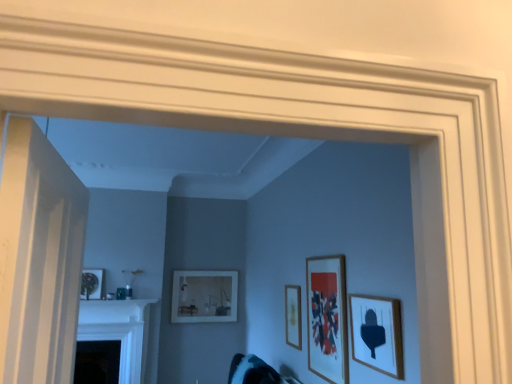
You are a GUI agent. You are given a task and a screenshot of the screen. Output one action in this format:
    pyautogui.click(x=<x>, y=<y>)
    Task: Click on the white wooden door at left
    The width and height of the screenshot is (512, 384).
    Given the screenshot: What is the action you would take?
    39,258

What is the approximate width of white wooden door at left?

The width of white wooden door at left is 19.13 centimeters.

How much space does matte white picture frame at center, which ranks as the 1th picture frame in back-to-front order, occupy vertically?

It is 28.64 inches.

Measure the distance between point (288, 289) and camera.

They are 12.94 feet apart.

Where is `wooden picture frame at right, which is the 4th picture frame from back to front`? wooden picture frame at right, which is the 4th picture frame from back to front is located at coordinates (377, 333).

What do you see at coordinates (119, 331) in the screenshot?
I see `black glossy fireplace at lower left` at bounding box center [119, 331].

Where is `white wooden door at left`? The image size is (512, 384). white wooden door at left is located at coordinates (39, 258).

Considering the positions of objects wooden picture frame at center, the 2th picture frame when ordered from back to front, and wooden picture frame at right, which is the 4th picture frame from back to front, in the image provided, who is more to the left, wooden picture frame at center, the 2th picture frame when ordered from back to front, or wooden picture frame at right, which is the 4th picture frame from back to front,?

wooden picture frame at center, the 2th picture frame when ordered from back to front.

From a real-world perspective, is wooden picture frame at center, the 2th picture frame when ordered from back to front, over wooden picture frame at right, acting as the fourth picture frame starting from the left?

No.

Image resolution: width=512 pixels, height=384 pixels. In order to click on the 2nd picture frame positioned below the wooden picture frame at right, acting as the fourth picture frame starting from the left (from the image's perspective) in this screenshot , I will do `click(293, 316)`.

Based on the photo, who is shorter, matte white picture frame at center, the fourth picture frame when ordered from right to left, or black glossy fireplace at lower left?

matte white picture frame at center, the fourth picture frame when ordered from right to left, is shorter.

From the image's perspective, who appears lower, matte white picture frame at center, the fourth picture frame when ordered from front to back, or black glossy fireplace at lower left?

From the image's view, black glossy fireplace at lower left is below.

Is matte white picture frame at center, which is the first picture frame from left to right, situated inside black glossy fireplace at lower left or outside?

matte white picture frame at center, which is the first picture frame from left to right, is located beyond the bounds of black glossy fireplace at lower left.

Does matte white picture frame at center, which ranks as the 1th picture frame in back-to-front order, appear on the left side of black glossy fireplace at lower left?

No, matte white picture frame at center, which ranks as the 1th picture frame in back-to-front order, is not to the left of black glossy fireplace at lower left.

Is the position of matte wooden picture frame at center, the 2th picture frame positioned from the right, less distant than that of white wooden door at left?

That is False.

How distant is matte wooden picture frame at center, the 2th picture frame positioned from the right, from white wooden door at left?

A distance of 6.35 feet exists between matte wooden picture frame at center, the 2th picture frame positioned from the right, and white wooden door at left.

Can you confirm if matte wooden picture frame at center, which appears as the second picture frame when viewed from the front, is wider than white wooden door at left?

No, matte wooden picture frame at center, which appears as the second picture frame when viewed from the front, is not wider than white wooden door at left.

Could you tell me if teal fabric swivel chair at lower center is turned towards matte white picture frame at center, which is the first picture frame from left to right?

No, teal fabric swivel chair at lower center is not facing towards matte white picture frame at center, which is the first picture frame from left to right.

In order to click on swivel chair lying in front of the matte white picture frame at center, which is the first picture frame from left to right in this screenshot , I will do `click(255, 372)`.

Would you consider teal fabric swivel chair at lower center to be distant from matte white picture frame at center, which ranks as the 1th picture frame in back-to-front order?

teal fabric swivel chair at lower center is positioned a significant distance from matte white picture frame at center, which ranks as the 1th picture frame in back-to-front order.

Is teal fabric swivel chair at lower center spatially inside matte white picture frame at center, which is the first picture frame from left to right, or outside of it?

teal fabric swivel chair at lower center is spatially situated outside matte white picture frame at center, which is the first picture frame from left to right.

In the scene shown: What's the angular difference between wooden picture frame at right, acting as the fourth picture frame starting from the left, and teal fabric swivel chair at lower center's facing directions?

wooden picture frame at right, acting as the fourth picture frame starting from the left, and teal fabric swivel chair at lower center are facing 2.17 degrees away from each other.

Can you see wooden picture frame at right, which ranks as the 1th picture frame in right-to-left order, touching teal fabric swivel chair at lower center?

No, wooden picture frame at right, which ranks as the 1th picture frame in right-to-left order, is not with teal fabric swivel chair at lower center.

From the image's perspective, relative to teal fabric swivel chair at lower center, is wooden picture frame at right, which ranks as the 1th picture frame in right-to-left order, above or below?

wooden picture frame at right, which ranks as the 1th picture frame in right-to-left order, is situated higher than teal fabric swivel chair at lower center in the image.

From a real-world perspective, is wooden picture frame at right, the 1th picture frame when ordered from front to back, beneath teal fabric swivel chair at lower center?

No.

Considering the relative sizes of white wooden door at left and teal fabric swivel chair at lower center in the image provided, is white wooden door at left taller than teal fabric swivel chair at lower center?

Indeed, white wooden door at left has a greater height compared to teal fabric swivel chair at lower center.

Measure the distance from white wooden door at left to teal fabric swivel chair at lower center.

white wooden door at left is 8.55 feet away from teal fabric swivel chair at lower center.

Considering the sizes of objects white wooden door at left and teal fabric swivel chair at lower center in the image provided, who is wider, white wooden door at left or teal fabric swivel chair at lower center?

With larger width is teal fabric swivel chair at lower center.

Considering the positions of points (9, 205) and (273, 380), is point (9, 205) closer to camera compared to point (273, 380)?

Yes, point (9, 205) is in front of point (273, 380).

Considering the sizes of wooden picture frame at right, which is the 4th picture frame from back to front, and black glossy fireplace at lower left in the image, is wooden picture frame at right, which is the 4th picture frame from back to front, taller or shorter than black glossy fireplace at lower left?

wooden picture frame at right, which is the 4th picture frame from back to front, is shorter than black glossy fireplace at lower left.

Is wooden picture frame at right, the 1th picture frame when ordered from front to back, thinner than black glossy fireplace at lower left?

Yes, wooden picture frame at right, the 1th picture frame when ordered from front to back, is thinner than black glossy fireplace at lower left.

Identify the location of fireplace that is on the left side of wooden picture frame at right, acting as the fourth picture frame starting from the left. (119, 331).

Considering the points (395, 345) and (82, 310), which point is behind, point (395, 345) or point (82, 310)?

Positioned behind is point (82, 310).

At what (x,y) coordinates should I click in order to perform the action: click on the 2nd picture frame to the left when counting from the wooden picture frame at right, acting as the fourth picture frame starting from the left. Please return your answer as a coordinate pair (x, y). The height and width of the screenshot is (384, 512). Looking at the image, I should click on (293, 316).

Identify the location of fireplace that appears in front of the matte white picture frame at center, the fourth picture frame when ordered from front to back. (119, 331).

Considering their positions, is white wooden door at left positioned closer to matte white picture frame at center, which is the first picture frame from left to right, than wooden picture frame at right, the 1th picture frame when ordered from front to back?

wooden picture frame at right, the 1th picture frame when ordered from front to back, is positioned closer to the anchor matte white picture frame at center, which is the first picture frame from left to right.

Based on the photo, based on their spatial positions, is wooden picture frame at center, the 2th picture frame when ordered from back to front, or black glossy fireplace at lower left further from matte wooden picture frame at center, the third picture frame from the left?

black glossy fireplace at lower left lies further to matte wooden picture frame at center, the third picture frame from the left, than the other object.

Estimate the real-world distances between objects in this image. Which object is further from matte white picture frame at center, which is the first picture frame from left to right, white wooden door at left or teal fabric swivel chair at lower center?

Based on the image, white wooden door at left appears to be further to matte white picture frame at center, which is the first picture frame from left to right.

Which object lies nearer to the anchor point wooden picture frame at right, which is the 4th picture frame from back to front, matte wooden picture frame at center, the third picture frame from the left, or matte white picture frame at center, which ranks as the 1th picture frame in back-to-front order?

The object closer to wooden picture frame at right, which is the 4th picture frame from back to front, is matte wooden picture frame at center, the third picture frame from the left.

Looking at the image, which one is located further to matte white picture frame at center, the fourth picture frame when ordered from right to left, black glossy fireplace at lower left or white wooden door at left?

Based on the image, white wooden door at left appears to be further to matte white picture frame at center, the fourth picture frame when ordered from right to left.

Estimate the real-world distances between objects in this image. Which object is closer to wooden picture frame at center, the 2th picture frame when ordered from back to front, matte white picture frame at center, which is the first picture frame from left to right, or black glossy fireplace at lower left?

Based on the image, matte white picture frame at center, which is the first picture frame from left to right, appears to be nearer to wooden picture frame at center, the 2th picture frame when ordered from back to front.

Which object lies nearer to the anchor point black glossy fireplace at lower left, wooden picture frame at right, acting as the fourth picture frame starting from the left, or matte wooden picture frame at center, the third picture frame from the left?

matte wooden picture frame at center, the third picture frame from the left.

Which object lies nearer to the anchor point matte white picture frame at center, which is the first picture frame from left to right, teal fabric swivel chair at lower center or matte wooden picture frame at center, which appears as the second picture frame when viewed from the front?

teal fabric swivel chair at lower center is positioned closer to the anchor matte white picture frame at center, which is the first picture frame from left to right.

Locate an element on the screen. The height and width of the screenshot is (384, 512). swivel chair located between wooden picture frame at right, the 1th picture frame when ordered from front to back, and matte white picture frame at center, the fourth picture frame when ordered from right to left, in the depth direction is located at coordinates (255, 372).

Locate an element on the screen. swivel chair between matte wooden picture frame at center, the third picture frame from the left, and wooden picture frame at center, which is the 2th picture frame in left-to-right order, from front to back is located at coordinates (255, 372).

You are a GUI agent. You are given a task and a screenshot of the screen. Output one action in this format:
    pyautogui.click(x=<x>, y=<y>)
    Task: Click on the swivel chair located between black glossy fireplace at lower left and wooden picture frame at center, which is the 2th picture frame in left-to-right order, in the left-right direction
    The width and height of the screenshot is (512, 384).
    Given the screenshot: What is the action you would take?
    pyautogui.click(x=255, y=372)

Locate an element on the screen. Image resolution: width=512 pixels, height=384 pixels. fireplace between teal fabric swivel chair at lower center and matte white picture frame at center, which ranks as the 1th picture frame in back-to-front order, along the z-axis is located at coordinates (119, 331).